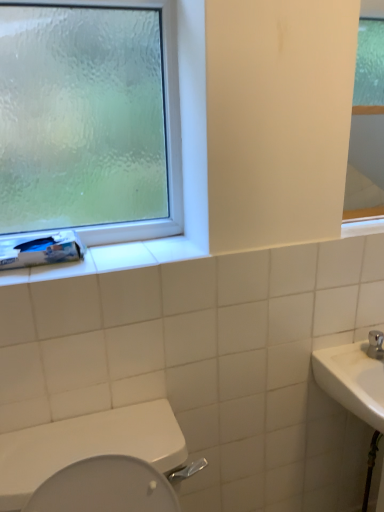
Question: From a real-world perspective, relative to frosted glass window at upper left, is white glossy toilet at lower left vertically above or below?

Choices:
 (A) above
 (B) below

Answer: (B)

Question: Considering their positions, is white glossy toilet at lower left located in front of or behind frosted glass window at upper left?

Choices:
 (A) behind
 (B) front

Answer: (B)

Question: Which is farther from the white glossy toilet at lower left?

Choices:
 (A) frosted glass window at upper left
 (B) white glossy mirror at upper right
 (C) white matte toilet paper at left

Answer: (B)

Question: Which object is the closest to the white matte toilet paper at left?

Choices:
 (A) white glossy mirror at upper right
 (B) white glossy toilet at lower left
 (C) frosted glass window at upper left

Answer: (C)